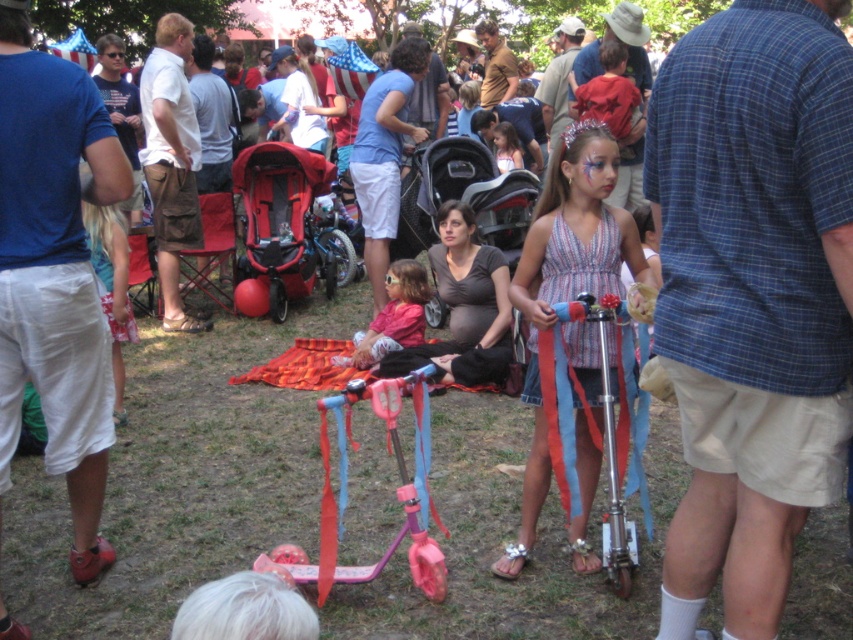
Question: Does striped fabric dress at center have a greater width compared to matte pink scooter at center?

Choices:
 (A) no
 (B) yes

Answer: (B)

Question: Which point is closer to the camera?

Choices:
 (A) (415, 422)
 (B) (582, 467)
 (C) (277, 161)
 (D) (399, 312)

Answer: (B)

Question: Which is farther from the pink plastic scooter at center?

Choices:
 (A) striped fabric dress at center
 (B) matte pink scooter at center
 (C) red fabric stroller at center

Answer: (C)

Question: Observing the image, what is the correct spatial positioning of pink plastic scooter at center in reference to matte pink scooter at center?

Choices:
 (A) below
 (B) above

Answer: (A)

Question: Does pink plastic scooter at center lie behind matte pink scooter at center?

Choices:
 (A) yes
 (B) no

Answer: (B)

Question: Which object appears closest to the camera in this image?

Choices:
 (A) striped fabric dress at center
 (B) matte pink scooter at center
 (C) pink plastic scooter at center

Answer: (C)